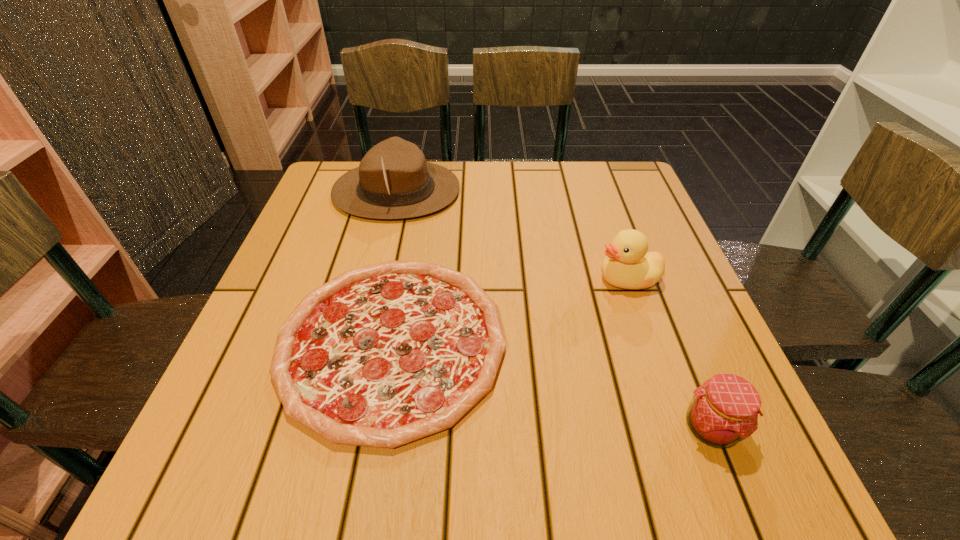
This screenshot has height=540, width=960. I want to click on free spot that satisfies the following two spatial constraints: 1. on the feather side of the fedora; 2. on the right side of the shortest object, so click(359, 342).

At what (x,y) coordinates should I click in order to perform the action: click on free location that satisfies the following two spatial constraints: 1. on the back side of the third tallest object; 2. on the feather side of the fedora. Please return your answer as a coordinate pair (x, y). This screenshot has width=960, height=540. Looking at the image, I should click on (616, 191).

I want to click on free point that satisfies the following two spatial constraints: 1. on the front side of the second shortest object; 2. on the left side of the shortest object, so click(377, 427).

Locate an element on the screen. free region that satisfies the following two spatial constraints: 1. on the feather side of the tallest object; 2. on the back side of the jam is located at coordinates (339, 427).

Identify the location of free spot that satisfies the following two spatial constraints: 1. on the feather side of the farthest object; 2. on the back side of the jam. Image resolution: width=960 pixels, height=540 pixels. (339, 427).

You are a GUI agent. You are given a task and a screenshot of the screen. Output one action in this format:
    pyautogui.click(x=<x>, y=<y>)
    Task: Click on the vacant point that satisfies the following two spatial constraints: 1. on the back side of the shortest object; 2. on the feather side of the farthest object
    This screenshot has width=960, height=540.
    Given the screenshot: What is the action you would take?
    pyautogui.click(x=420, y=191)

Where is `free space that satisfies the following two spatial constraints: 1. on the back side of the jam; 2. on the feather side of the tallest object`? free space that satisfies the following two spatial constraints: 1. on the back side of the jam; 2. on the feather side of the tallest object is located at coordinates (616, 191).

I want to click on free region that satisfies the following two spatial constraints: 1. at the beak of the second tallest object; 2. on the left side of the jam, so click(678, 427).